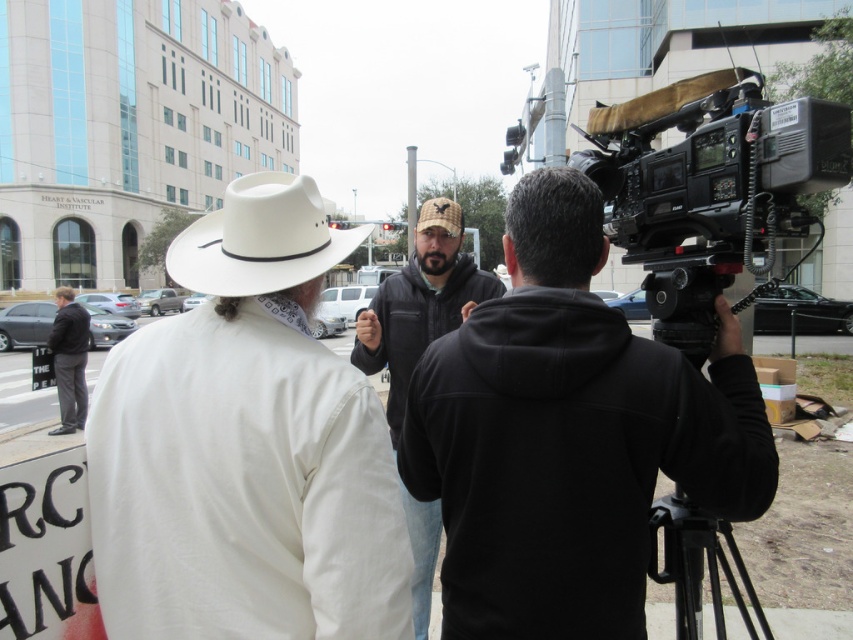
You are a photographer trying to capture a candid shot of the person in the dark jacket and jeans who is gesturing with their right hand. The camera you are using has a limited field of view and can only focus on objects within a 0.3 meter radius of the point at coordinates point (711, 188). Will this point allow you to capture the person in the dark jacket and jeans effectively?

The point (711, 188) is located on the black plastic video camera at upper right. Since the camera is positioned at the upper right, the person in the dark jacket and jeans is likely outside the 0.3 meter radius of this point, making it difficult to capture them effectively with this focus point.

You are standing at the center of the scene and want to locate the white matte cowboy hat at upper left. Based on its coordinates, in which direction should you look to find it?

The white matte cowboy hat at upper left is located at coordinates point (247, 445), which means it is positioned to the upper left relative to your viewpoint. You should look towards the upper left direction to find it.